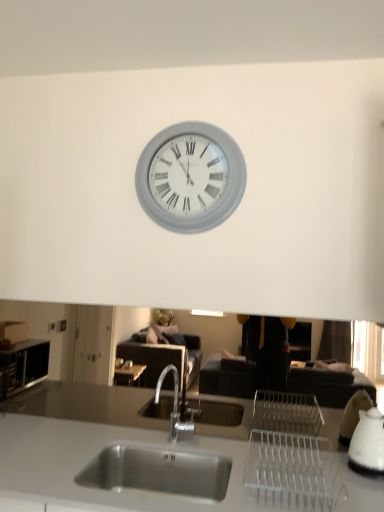
Question: Considering the relative positions of white glossy kettle at right and stainless steel sink at center in the image provided, is white glossy kettle at right to the right of stainless steel sink at center from the viewer's perspective?

Choices:
 (A) no
 (B) yes

Answer: (B)

Question: Can stainless steel sink at center be found inside white glossy kettle at right?

Choices:
 (A) yes
 (B) no

Answer: (B)

Question: Is white glossy kettle at right wider than stainless steel sink at center?

Choices:
 (A) yes
 (B) no

Answer: (B)

Question: Can you confirm if white glossy kettle at right is thinner than stainless steel sink at center?

Choices:
 (A) no
 (B) yes

Answer: (B)

Question: Is white glossy kettle at right at the left side of stainless steel sink at center?

Choices:
 (A) no
 (B) yes

Answer: (A)

Question: Is stainless steel sink at center spatially inside white glossy kettle at right, or outside of it?

Choices:
 (A) outside
 (B) inside

Answer: (A)

Question: Based on their positions, is stainless steel sink at center located to the left or right of white glossy kettle at right?

Choices:
 (A) left
 (B) right

Answer: (A)

Question: From the image's perspective, is stainless steel sink at center positioned above or below white glossy kettle at right?

Choices:
 (A) below
 (B) above

Answer: (A)

Question: In terms of height, does stainless steel sink at center look taller or shorter compared to white glossy kettle at right?

Choices:
 (A) tall
 (B) short

Answer: (B)

Question: Is white glossy kettle at right wider or thinner than gray matte clock at upper center?

Choices:
 (A) thin
 (B) wide

Answer: (B)

Question: Does point (365, 461) appear closer or farther from the camera than point (230, 212)?

Choices:
 (A) farther
 (B) closer

Answer: (B)

Question: From the image's perspective, is white glossy kettle at right above or below gray matte clock at upper center?

Choices:
 (A) below
 (B) above

Answer: (A)

Question: From a real-world perspective, is white glossy kettle at right above or below gray matte clock at upper center?

Choices:
 (A) below
 (B) above

Answer: (A)

Question: Is white glossy kettle at right taller or shorter than stainless steel sink at center?

Choices:
 (A) short
 (B) tall

Answer: (B)

Question: Considering the positions of point (364, 420) and point (147, 450), is point (364, 420) closer or farther from the camera than point (147, 450)?

Choices:
 (A) farther
 (B) closer

Answer: (B)